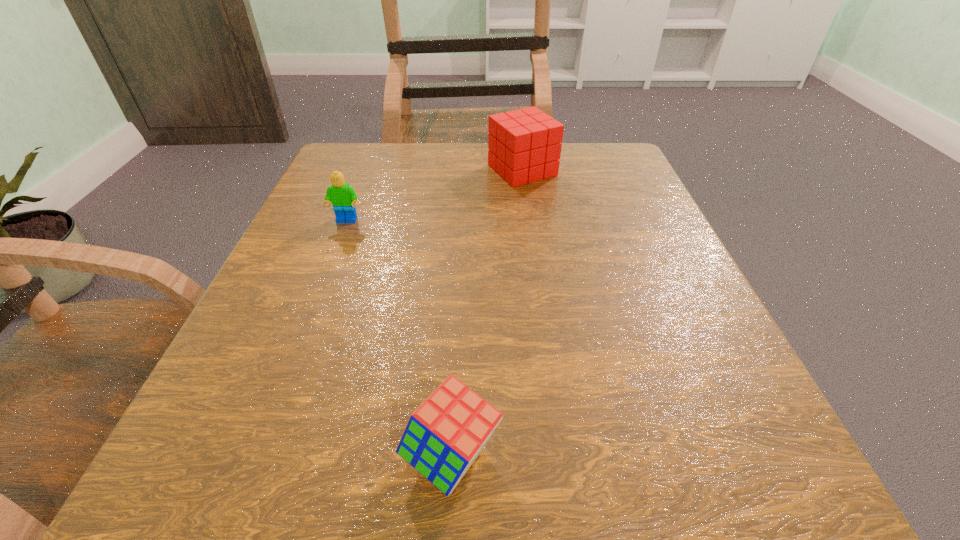
Locate an element on the screen. This screenshot has height=540, width=960. object located at the left edge is located at coordinates (342, 196).

Locate an element on the screen. free space at the far edge of the desktop is located at coordinates (500, 186).

Identify the location of vacant region at the near edge of the desktop. Image resolution: width=960 pixels, height=540 pixels. (608, 516).

You are a GUI agent. You are given a task and a screenshot of the screen. Output one action in this format:
    pyautogui.click(x=<x>, y=<y>)
    Task: Click on the free space at the left edge of the desktop
    
    Given the screenshot: What is the action you would take?
    pyautogui.click(x=291, y=303)

The height and width of the screenshot is (540, 960). Find the location of `free space at the right edge of the desktop`. free space at the right edge of the desktop is located at coordinates (598, 296).

I want to click on vacant space at the far left corner of the desktop, so click(327, 173).

The image size is (960, 540). Identify the location of vacant area at the near left corner. (166, 517).

Identify the location of vacant space at the far right corner. (564, 190).

In order to click on blank area at the near right corner in this screenshot , I will do `click(662, 446)`.

This screenshot has height=540, width=960. What are the coordinates of `vacant area that lies between the nearest object and the farther cube` in the screenshot? It's located at (487, 313).